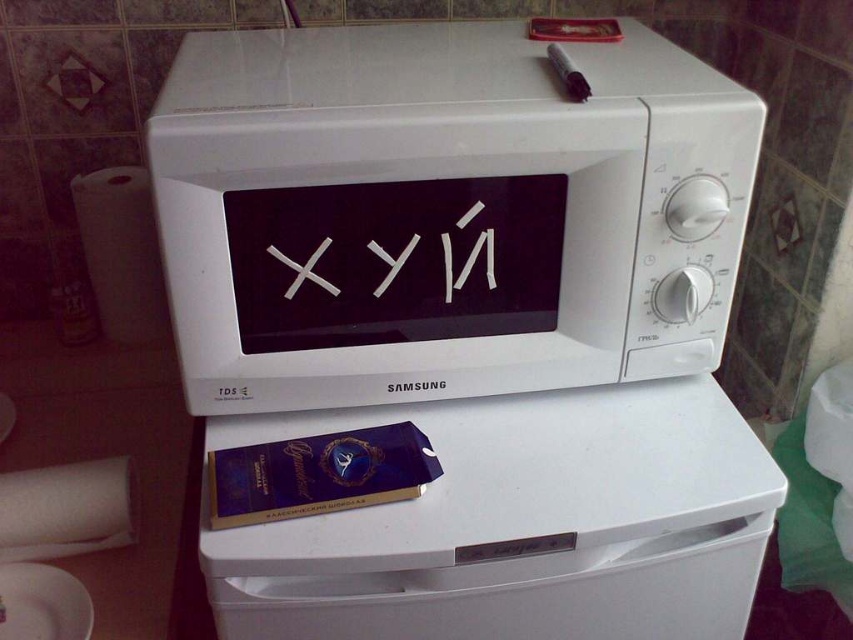
Question: Can you confirm if white matte microwave at center is smaller than white plastic microwave at upper center?

Choices:
 (A) no
 (B) yes

Answer: (A)

Question: Does white matte microwave at center have a larger size compared to white plastic microwave at upper center?

Choices:
 (A) yes
 (B) no

Answer: (A)

Question: Can you confirm if white matte microwave at center is positioned below white plastic microwave at upper center?

Choices:
 (A) yes
 (B) no

Answer: (B)

Question: Among these points, which one is farthest from the camera?

Choices:
 (A) (265, 636)
 (B) (271, 74)

Answer: (B)